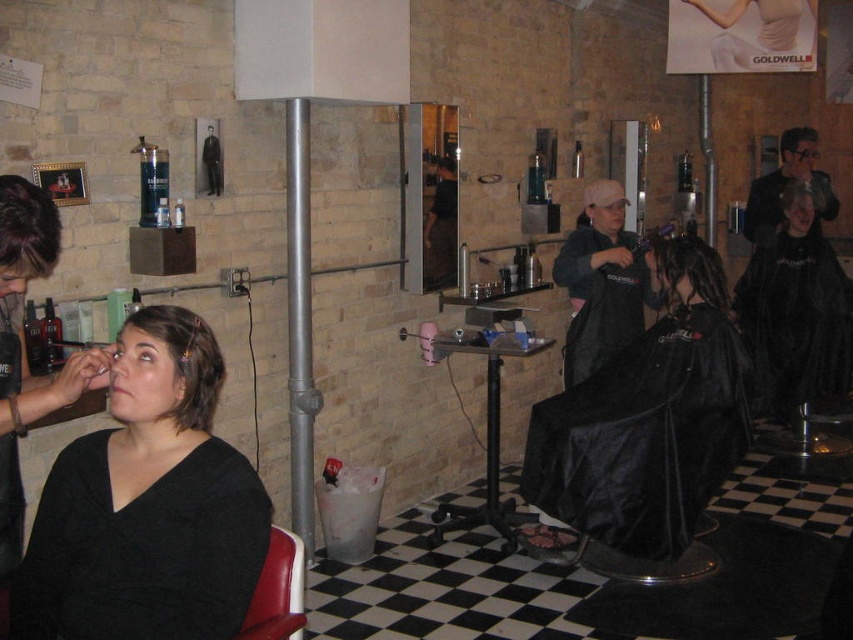
Question: Does dark gray fabric at center appear under brown matte hair at left?

Choices:
 (A) yes
 (B) no

Answer: (B)

Question: Is matte black hair at center behind black matte hairdresser cape at center?

Choices:
 (A) yes
 (B) no

Answer: (B)

Question: Which of the following is the farthest from the observer?

Choices:
 (A) black matte hair at center
 (B) dreadlocks at center

Answer: (B)

Question: Estimate the real-world distances between objects in this image. Which object is closer to the dark brown leather jacket at upper right?

Choices:
 (A) shiny black hair at center
 (B) dreadlocks at center

Answer: (A)

Question: Which of the following is the farthest from the observer?

Choices:
 (A) (50, 268)
 (B) (196, 396)
 (C) (808, 138)
 (D) (581, 353)

Answer: (C)

Question: Is brown matte hair at left positioned behind dark brown hair at upper left?

Choices:
 (A) no
 (B) yes

Answer: (B)